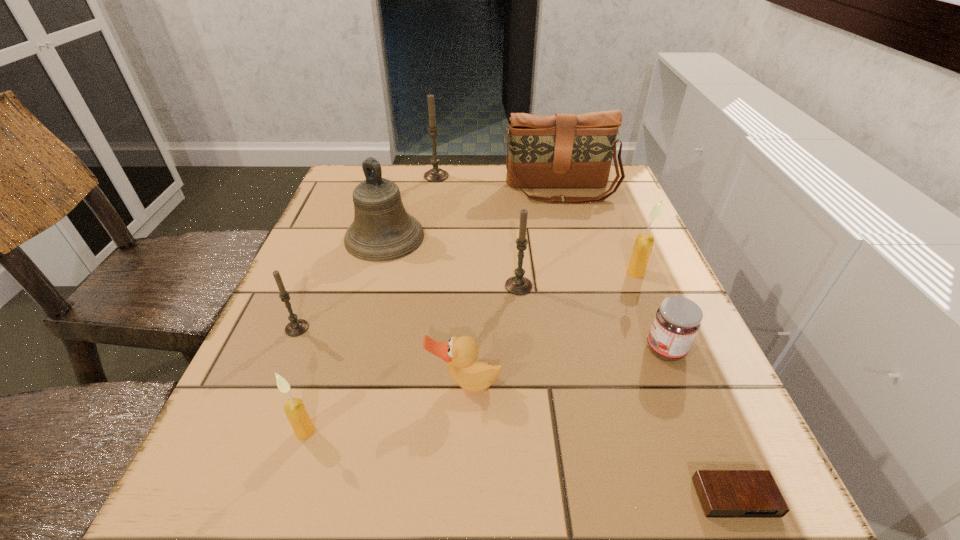
Locate an element on the screen. This screenshot has width=960, height=540. shoulder bag present at the right edge is located at coordinates (564, 150).

This screenshot has height=540, width=960. Find the location of `candle located in the right edge section of the desktop`. candle located in the right edge section of the desktop is located at coordinates (643, 245).

Locate an element on the screen. This screenshot has width=960, height=540. jam situated at the right edge is located at coordinates (677, 321).

Find the location of a particular element. alarm clock located in the right edge section of the desktop is located at coordinates (722, 493).

Image resolution: width=960 pixels, height=540 pixels. What are the coordinates of `object positioned at the far right corner` in the screenshot? It's located at (564, 150).

This screenshot has width=960, height=540. I want to click on object that is at the near right corner, so click(722, 493).

Locate an element on the screen. Image resolution: width=960 pixels, height=540 pixels. vacant position at the far edge of the desktop is located at coordinates (505, 197).

At what (x,y) coordinates should I click in order to perform the action: click on vacant region at the near edge of the desktop. Please return your answer as a coordinate pair (x, y). This screenshot has width=960, height=540. Looking at the image, I should click on (600, 477).

You are a GUI agent. You are given a task and a screenshot of the screen. Output one action in this format:
    pyautogui.click(x=<x>, y=<y>)
    Task: Click on the vacant space at the left edge of the desktop
    
    Given the screenshot: What is the action you would take?
    pyautogui.click(x=321, y=264)

This screenshot has height=540, width=960. What are the coordinates of `vacant region at the right edge of the desktop` in the screenshot? It's located at (617, 237).